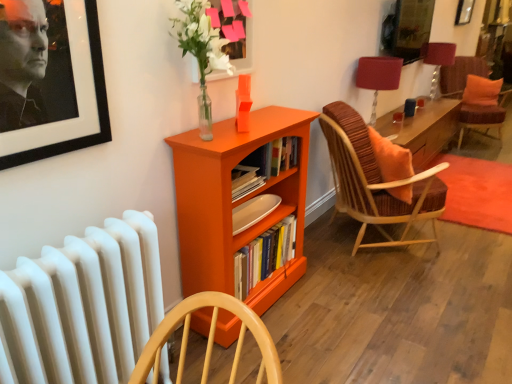
Identify the location of free space in front of wooden woven chair with orange cushion at right, which ranks as the first chair in front-to-back order. The width and height of the screenshot is (512, 384). (402, 297).